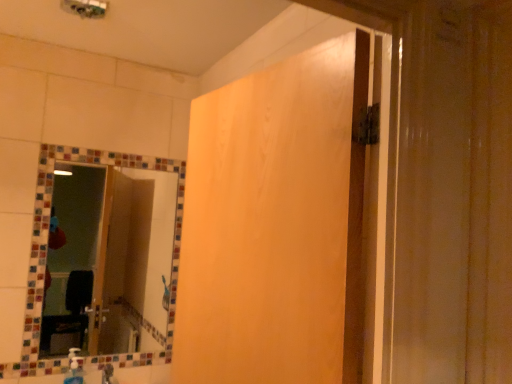
Where is `multicolored mosaic mirror at upper left`? multicolored mosaic mirror at upper left is located at coordinates (137, 257).

Is translucent plastic soap dispenser at lower left to the left of wooden panel at center from the viewer's perspective?

Yes, translucent plastic soap dispenser at lower left is to the left of wooden panel at center.

Would you say translucent plastic soap dispenser at lower left is inside or outside wooden panel at center?

translucent plastic soap dispenser at lower left is outside wooden panel at center.

Is translucent plastic soap dispenser at lower left oriented away from wooden panel at center?

No, translucent plastic soap dispenser at lower left is not facing away from wooden panel at center.

Who is shorter, translucent plastic soap dispenser at lower left or wooden panel at center?

translucent plastic soap dispenser at lower left.

What's the angular difference between multicolored mosaic mirror at upper left and translucent plastic soap dispenser at lower left's facing directions?

multicolored mosaic mirror at upper left and translucent plastic soap dispenser at lower left are facing 4.8 degrees away from each other.

Measure the distance from multicolored mosaic mirror at upper left to translucent plastic soap dispenser at lower left.

multicolored mosaic mirror at upper left and translucent plastic soap dispenser at lower left are 3.35 feet apart from each other.

Who is more distant, multicolored mosaic mirror at upper left or translucent plastic soap dispenser at lower left?

multicolored mosaic mirror at upper left is further from the camera.

Is multicolored mosaic mirror at upper left wider or thinner than translucent plastic soap dispenser at lower left?

Considering their sizes, multicolored mosaic mirror at upper left looks slimmer than translucent plastic soap dispenser at lower left.

Is multicolored mosaic mirror at upper left oriented towards wooden panel at center?

Yes, multicolored mosaic mirror at upper left is turned towards wooden panel at center.

From the image's perspective, between multicolored mosaic mirror at upper left and wooden panel at center, who is located below?

From the image's view, multicolored mosaic mirror at upper left is below.

Between multicolored mosaic mirror at upper left and wooden panel at center, which one has less height?

wooden panel at center.

Is multicolored mosaic mirror at upper left bigger than wooden panel at center?

Incorrect, multicolored mosaic mirror at upper left is not larger than wooden panel at center.

Which is more to the left, wooden panel at center or translucent plastic soap dispenser at lower left?

translucent plastic soap dispenser at lower left.

How different are the orientations of wooden panel at center and translucent plastic soap dispenser at lower left in degrees?

The facing directions of wooden panel at center and translucent plastic soap dispenser at lower left are 84.9 degrees apart.

Between wooden panel at center and translucent plastic soap dispenser at lower left, which one has larger size?

With larger size is wooden panel at center.

Is wooden panel at center aimed at translucent plastic soap dispenser at lower left?

No, wooden panel at center does not turn towards translucent plastic soap dispenser at lower left.

Does translucent plastic soap dispenser at lower left appear on the left side of multicolored mosaic mirror at upper left?

Indeed, translucent plastic soap dispenser at lower left is positioned on the left side of multicolored mosaic mirror at upper left.

Where is `soap dispenser on the left of multicolored mosaic mirror at upper left`? soap dispenser on the left of multicolored mosaic mirror at upper left is located at coordinates (74, 370).

How distant is translucent plastic soap dispenser at lower left from multicolored mosaic mirror at upper left?

translucent plastic soap dispenser at lower left and multicolored mosaic mirror at upper left are 1.02 meters apart from each other.

From the image's perspective, which is below, translucent plastic soap dispenser at lower left or multicolored mosaic mirror at upper left?

translucent plastic soap dispenser at lower left appears lower in the image.

How different are the orientations of wooden panel at center and multicolored mosaic mirror at upper left in degrees?

The facing directions of wooden panel at center and multicolored mosaic mirror at upper left are 80.1 degrees apart.

Which object is closer to the camera taking this photo, wooden panel at center or multicolored mosaic mirror at upper left?

wooden panel at center.

At what (x,y) coordinates should I click in order to perform the action: click on mirror that is under the wooden panel at center (from a real-world perspective). Please return your answer as a coordinate pair (x, y). The width and height of the screenshot is (512, 384). Looking at the image, I should click on (137, 257).

From the image's perspective, is wooden panel at center on multicolored mosaic mirror at upper left?

Indeed, from the image's perspective, wooden panel at center is shown above multicolored mosaic mirror at upper left.

Locate an element on the screen. screen door in front of the translucent plastic soap dispenser at lower left is located at coordinates (276, 224).

In the image, there is a multicolored mosaic mirror at upper left. Identify the location of soap dispenser below it (from the image's perspective). Image resolution: width=512 pixels, height=384 pixels. (74, 370).

Looking at the image, which one is located closer to wooden panel at center, translucent plastic soap dispenser at lower left or multicolored mosaic mirror at upper left?

The object closer to wooden panel at center is multicolored mosaic mirror at upper left.

When comparing their distances from multicolored mosaic mirror at upper left, does wooden panel at center or translucent plastic soap dispenser at lower left seem closer?

The object closer to multicolored mosaic mirror at upper left is translucent plastic soap dispenser at lower left.

Which object lies further to the anchor point multicolored mosaic mirror at upper left, translucent plastic soap dispenser at lower left or wooden panel at center?

The object further to multicolored mosaic mirror at upper left is wooden panel at center.

Which object lies nearer to the anchor point translucent plastic soap dispenser at lower left, multicolored mosaic mirror at upper left or wooden panel at center?

multicolored mosaic mirror at upper left.

Which object lies further to the anchor point translucent plastic soap dispenser at lower left, wooden panel at center or multicolored mosaic mirror at upper left?

Based on the image, wooden panel at center appears to be further to translucent plastic soap dispenser at lower left.

Considering their positions, is multicolored mosaic mirror at upper left positioned further to wooden panel at center than translucent plastic soap dispenser at lower left?

translucent plastic soap dispenser at lower left is further to wooden panel at center.

Locate an element on the screen. This screenshot has width=512, height=384. soap dispenser between wooden panel at center and multicolored mosaic mirror at upper left along the z-axis is located at coordinates tap(74, 370).